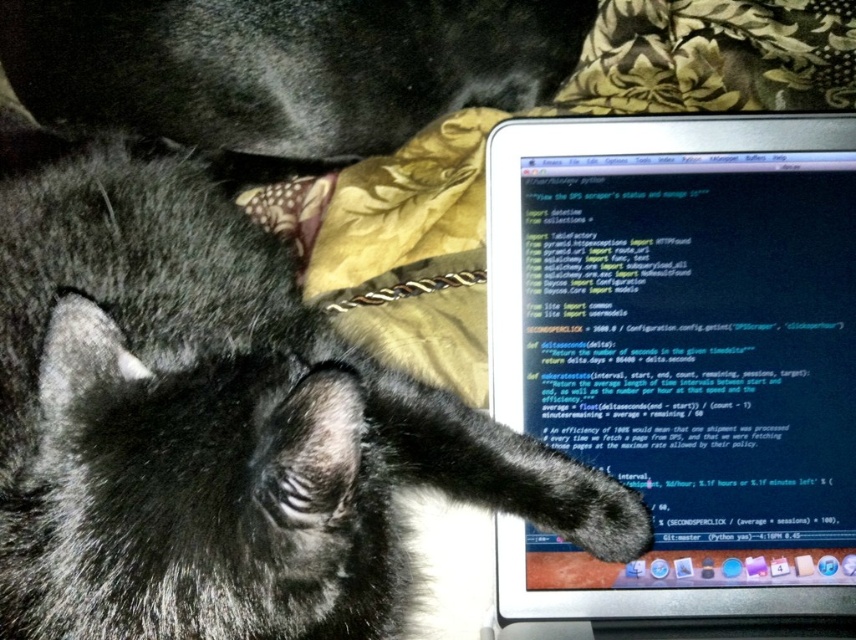
Question: Does black fur cat at center have a larger size compared to matte black laptop at upper right?

Choices:
 (A) yes
 (B) no

Answer: (A)

Question: Which object is positioned closest to the matte black laptop at upper right?

Choices:
 (A) black fur cat at upper left
 (B) black fur cat at center

Answer: (B)

Question: Which point appears closest to the camera in this image?

Choices:
 (A) (842, 544)
 (B) (15, 232)
 (C) (296, 3)

Answer: (A)

Question: Does matte black laptop at upper right have a larger size compared to black fur cat at upper left?

Choices:
 (A) no
 (B) yes

Answer: (A)

Question: Can you confirm if black fur cat at center is positioned above matte black laptop at upper right?

Choices:
 (A) yes
 (B) no

Answer: (A)

Question: Which object is farther from the camera taking this photo?

Choices:
 (A) matte black laptop at upper right
 (B) black fur cat at upper left
 (C) black fur cat at center

Answer: (B)